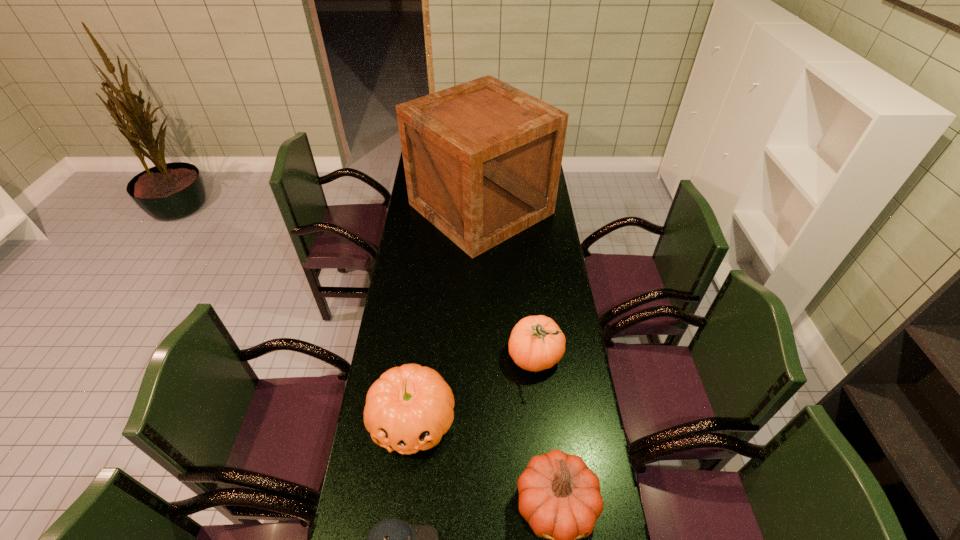
Find the location of a particular element. The height and width of the screenshot is (540, 960). the closest pumpkin to the nearest pumpkin is located at coordinates (409, 408).